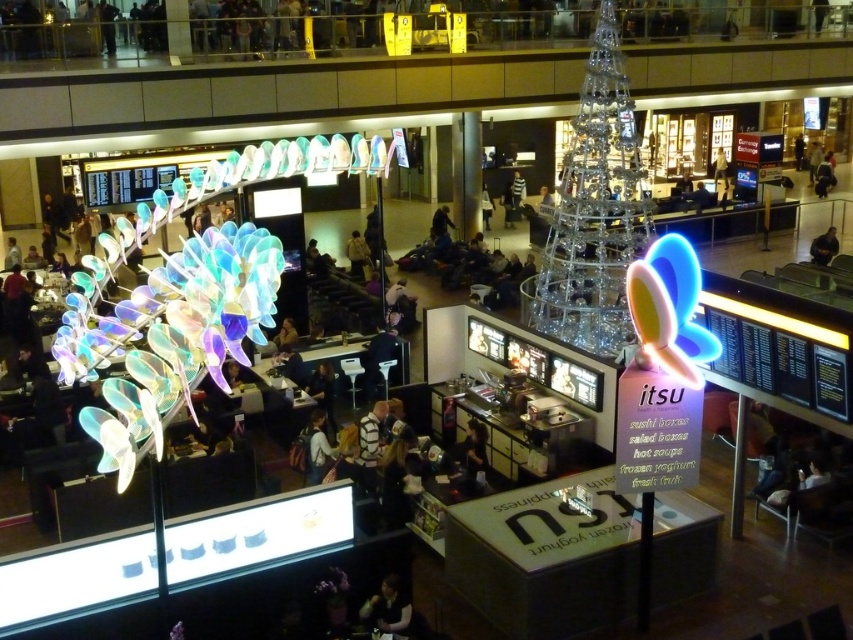
Question: Can you confirm if clear glass christmas tree at center is positioned to the left of dark gray sweater at lower center?

Choices:
 (A) no
 (B) yes

Answer: (A)

Question: Considering the relative positions of black fabric jacket at lower right and matte black jacket at center in the image provided, where is black fabric jacket at lower right located with respect to matte black jacket at center?

Choices:
 (A) above
 (B) below

Answer: (B)

Question: Estimate the real-world distances between objects in this image. Which object is closer to the matte black jacket at center?

Choices:
 (A) dark gray sweater at lower center
 (B) clear glass christmas tree at center

Answer: (B)

Question: In this image, where is clear glass christmas tree at center located relative to dark gray sweater at lower center?

Choices:
 (A) left
 (B) right

Answer: (B)

Question: Which point appears farthest from the camera in this image?

Choices:
 (A) (720, 168)
 (B) (645, 230)
 (C) (833, 241)
 (D) (378, 628)

Answer: (A)

Question: Which point appears farthest from the camera in this image?

Choices:
 (A) (717, 172)
 (B) (567, 163)

Answer: (A)